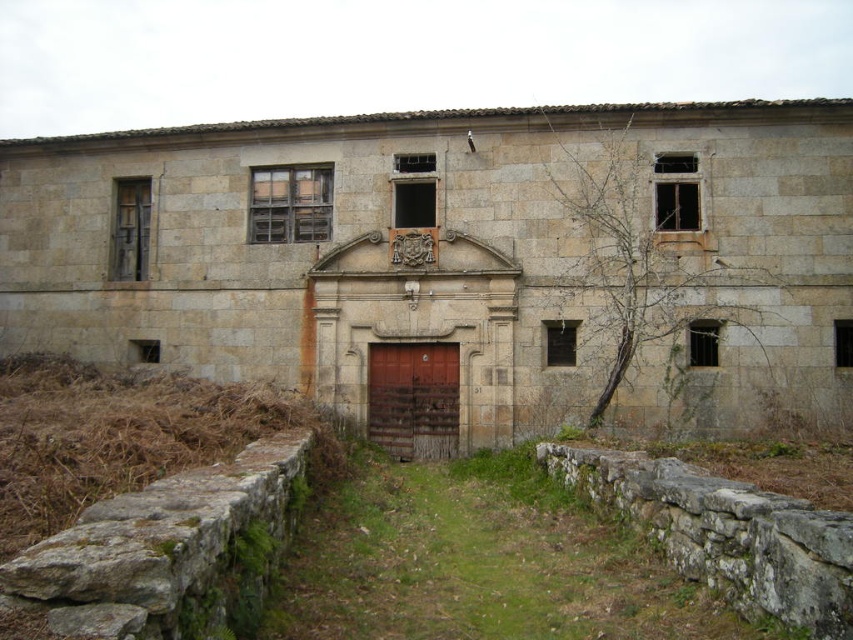
You are standing in front of the old stone building and notice two points marked on its facade. The first point is at coordinates point (178, 401) and the second is at point (392, 352). Which point is closer to your current position?

Point (178, 401) is closer to the camera than point (392, 352), so the first point is closer to your current position.

You are standing in front of the old stone building. You see the brown grassy hay at lower left and the rusty metal door at center. Which object is closer to the ground?

The brown grassy hay at lower left is closer to the ground since it is positioned below the rusty metal door at center.

You are standing in front of the old stone building and want to enter through the rusty metal door at center. To your left, there is brown grassy hay at lower left. Which direction should you walk to reach the door without stepping on the hay?

You should walk to the right side of the brown grassy hay at lower left to reach the rusty metal door at center since the hay is positioned to the left of the door.